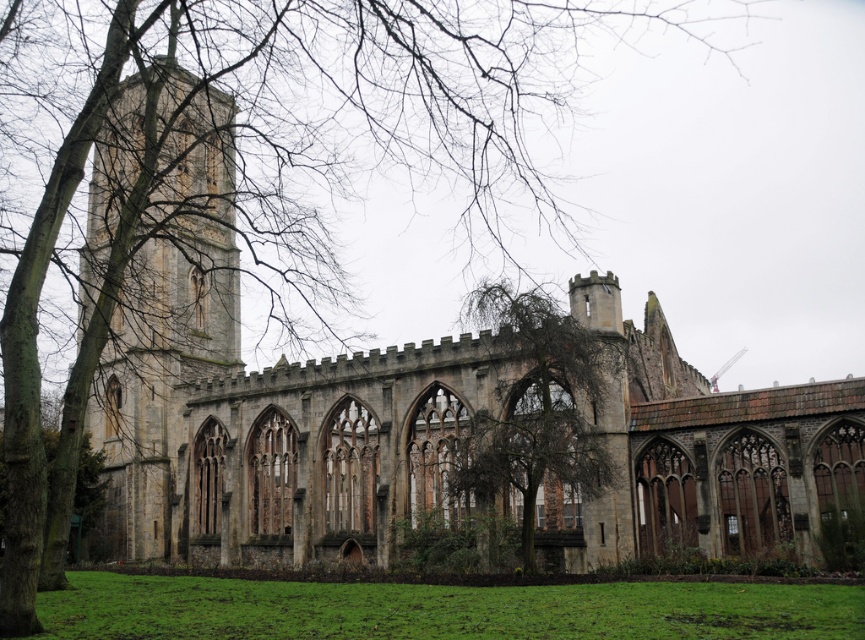
You are standing in front of the historic stone building ruins. You notice the green grass at lower center and the brown textured tree at center. Which object is closer to you?

The green grass at lower center is closer to you because it is in front of the brown textured tree at center.

You are standing at the green grass at lower center and want to take a photo of the stone tower at left. In which direction should you point your camera?

You should point your camera to the left because the stone tower at left is located to the left of the green grass at lower center.

You are standing in front of the historic stone building ruins and want to determine the relative positions of two points marked in the image. Which of the two points, point 1 at coordinates point (210,502) or point 2 at coordinates point (524,308), is closer to you?

Point 1 at coordinates point (210,502) is closer to you because it is further to the viewer than point 2 at coordinates point (524,308).